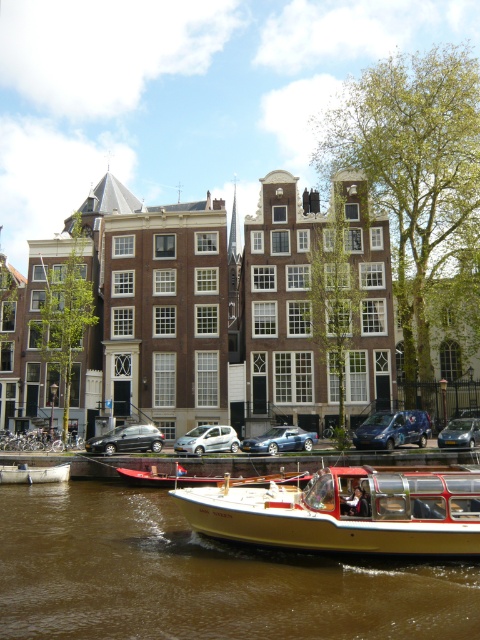
Question: Which object is farther from the camera taking this photo?

Choices:
 (A) metallic blue van at center
 (B) matte silver car at center
 (C) shiny silver hatchback at center
 (D) silver metallic hatchback at center

Answer: (C)

Question: Estimate the real-world distances between objects in this image. Which object is closer to the brown water at center?

Choices:
 (A) gold polished wood boat at lower center
 (B) white wooden boat at lower left
 (C) metallic blue van at center
 (D) metallic blue car at center

Answer: (A)

Question: Can you confirm if gold polished wood boat at lower center is positioned to the left of metallic blue van at center?

Choices:
 (A) no
 (B) yes

Answer: (B)

Question: Is metallic blue van at center positioned behind shiny silver hatchback at center?

Choices:
 (A) no
 (B) yes

Answer: (A)

Question: Is the position of silver metallic hatchback at center less distant than that of metallic blue car at center?

Choices:
 (A) no
 (B) yes

Answer: (A)

Question: Which object is closer to the camera taking this photo?

Choices:
 (A) gold polished wood boat at lower center
 (B) metallic blue car at center
 (C) silver metallic hatchback at center
 (D) matte silver car at center

Answer: (A)